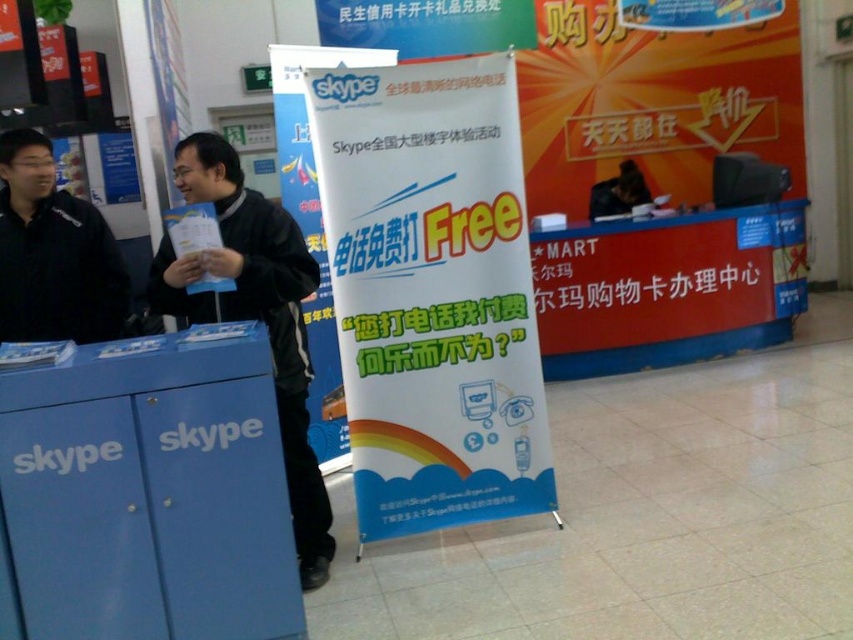
Consider the image. You are standing in front of the Skype promotional banner and notice two points marked in the scene. The first point is at coordinates point (x=529, y=477) and the second at point (x=74, y=196). From your vantage point, which point is closer to you?

Point (x=529, y=477) is in front of point (x=74, y=196), so it is closer to you.

What is located at the point with coordinates (432, 292) in the image?

The point at coordinates (432, 292) marks the location of the white paper sign at center.

You are standing in front of the Skype promotional banner and see two black matte jackets. Which one is nearer to you, the black matte jacket at center or the black matte jacket at left?

The black matte jacket at center is closer to the viewer than the black matte jacket at left.